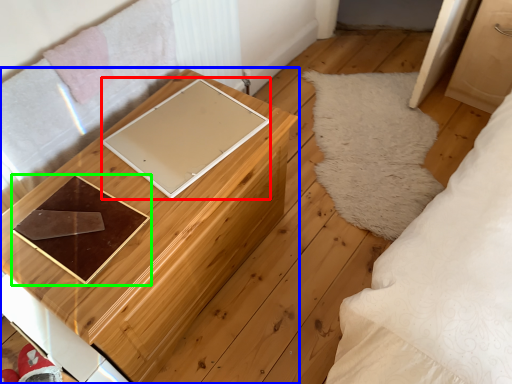
Question: Considering the real-world distances, which object is closest to pad (highlighted by a red box)? furniture (highlighted by a blue box) or tray (highlighted by a green box).

Choices:
 (A) furniture
 (B) tray

Answer: (A)